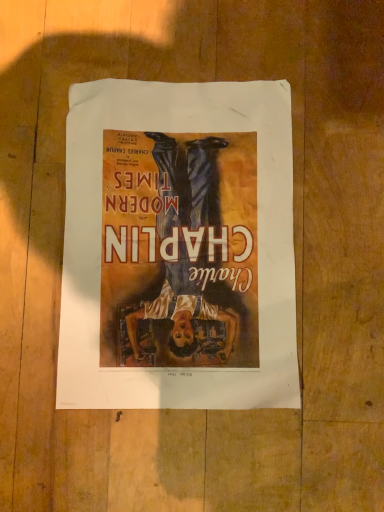
Measure the distance between point (227, 152) and camera.

The depth of point (227, 152) is 15.39 inches.

This screenshot has height=512, width=384. Describe the element at coordinates (178, 247) in the screenshot. I see `matte paper poster at center` at that location.

Locate an element on the screen. The width and height of the screenshot is (384, 512). matte paper poster at center is located at coordinates (178, 247).

Image resolution: width=384 pixels, height=512 pixels. I want to click on matte paper poster at center, so click(x=178, y=247).